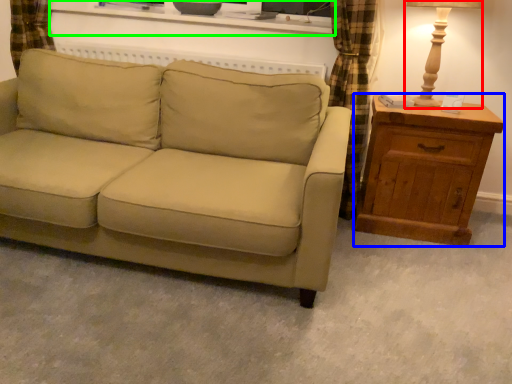
Question: Which object is positioned closest to table lamp (highlighted by a red box)? Select from chest of drawers (highlighted by a blue box) and entertainment center (highlighted by a green box).

Choices:
 (A) chest of drawers
 (B) entertainment center

Answer: (A)